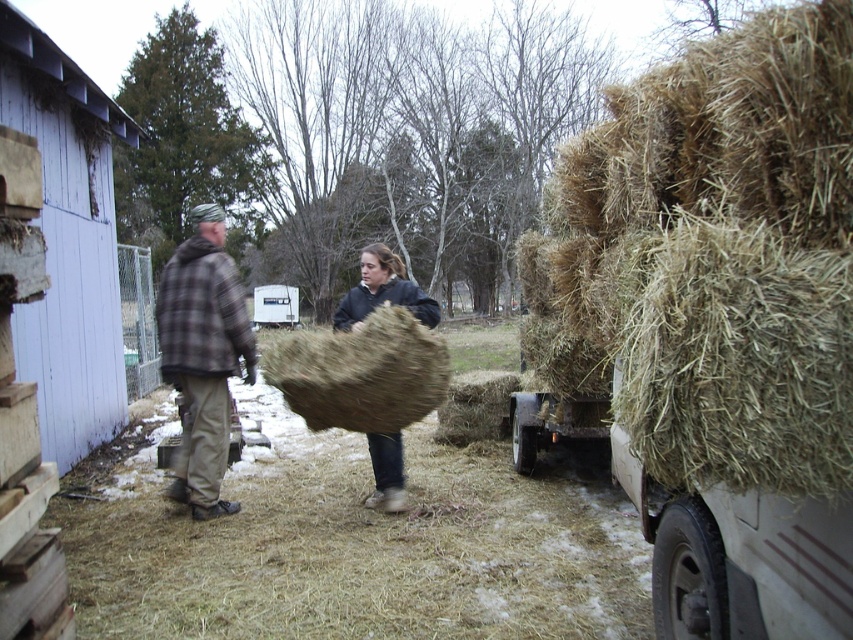
Question: Does natural straw bale at center appear over dark brown woolen sweater at center?

Choices:
 (A) yes
 (B) no

Answer: (B)

Question: Can you confirm if plaid fabric jacket at left is bigger than natural straw bale at center?

Choices:
 (A) no
 (B) yes

Answer: (B)

Question: Estimate the real-world distances between objects in this image. Which object is closer to the dark brown woolen sweater at center?

Choices:
 (A) brown straw bales at right
 (B) natural straw bale at center

Answer: (A)

Question: Can you confirm if brown straw bales at right is positioned below brown plaid shirt at center?

Choices:
 (A) yes
 (B) no

Answer: (A)

Question: Which point appears farthest from the camera in this image?

Choices:
 (A) (373, 321)
 (B) (375, 474)
 (C) (387, 492)

Answer: (B)

Question: Which object is closer to the camera taking this photo?

Choices:
 (A) natural straw bale at center
 (B) plaid fabric jacket at left
 (C) dark brown woolen sweater at center
 (D) brown straw bales at right

Answer: (D)